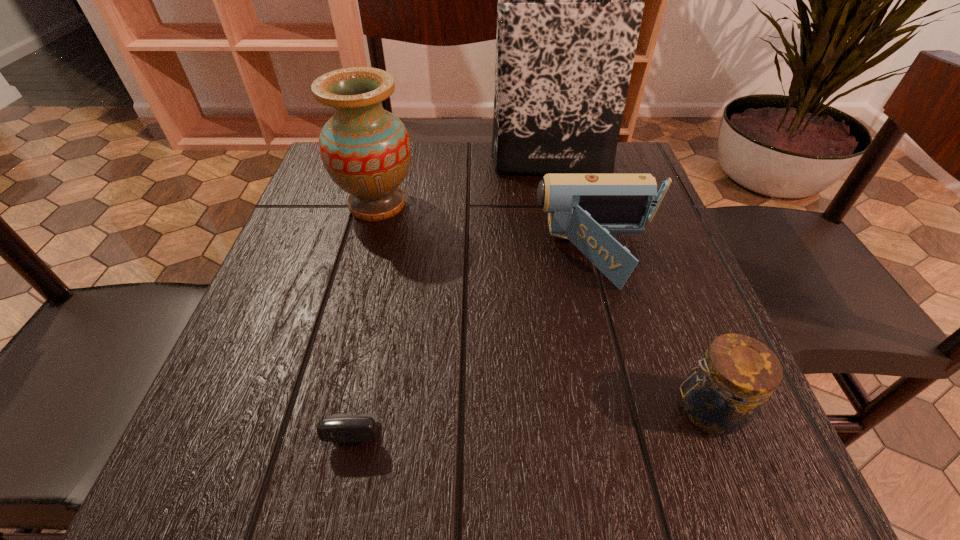
At what (x,y) coordinates should I click in order to perform the action: click on vacant space at the left edge of the desktop. Please return your answer as a coordinate pair (x, y). The image size is (960, 540). Looking at the image, I should click on (212, 396).

The height and width of the screenshot is (540, 960). In the image, there is a desktop. Find the location of `vacant space at the right edge`. vacant space at the right edge is located at coordinates (670, 368).

The width and height of the screenshot is (960, 540). In order to click on vacant space at the near left corner of the desktop in this screenshot , I will do `click(204, 455)`.

Image resolution: width=960 pixels, height=540 pixels. Find the location of `vacant space at the near right corner`. vacant space at the near right corner is located at coordinates (739, 455).

The height and width of the screenshot is (540, 960). In order to click on vacant area that lies between the jar and the vase in this screenshot , I will do `click(542, 306)`.

Identify the location of free space between the second tallest object and the jar. The image size is (960, 540). (542, 306).

This screenshot has height=540, width=960. I want to click on free space between the jar and the camcorder, so click(653, 333).

I want to click on free spot between the camcorder and the jar, so click(653, 333).

At what (x,y) coordinates should I click in order to perform the action: click on empty location between the jar and the camcorder. Please return your answer as a coordinate pair (x, y). This screenshot has width=960, height=540. Looking at the image, I should click on (653, 333).

Identify the location of free space between the farthest object and the second tallest object. This screenshot has width=960, height=540. (464, 184).